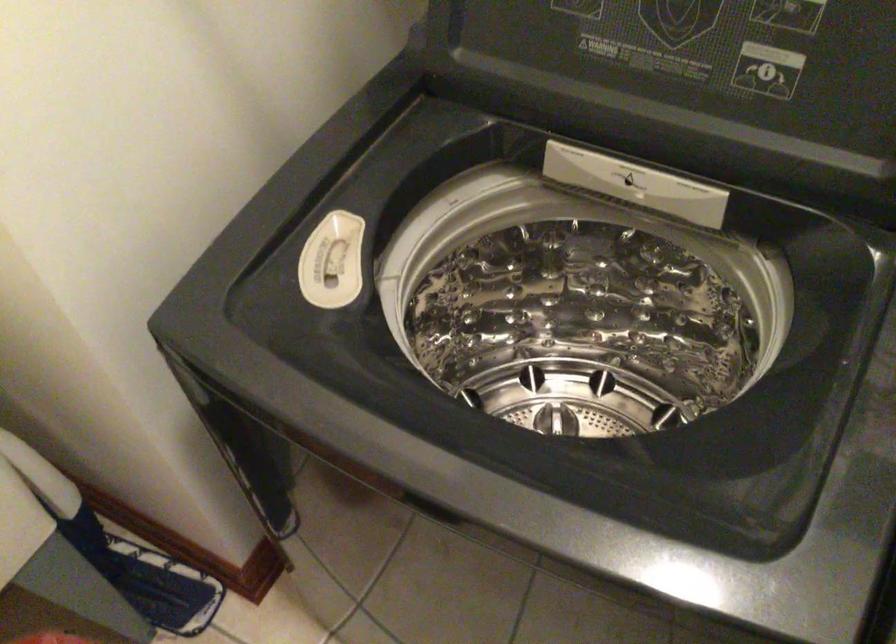
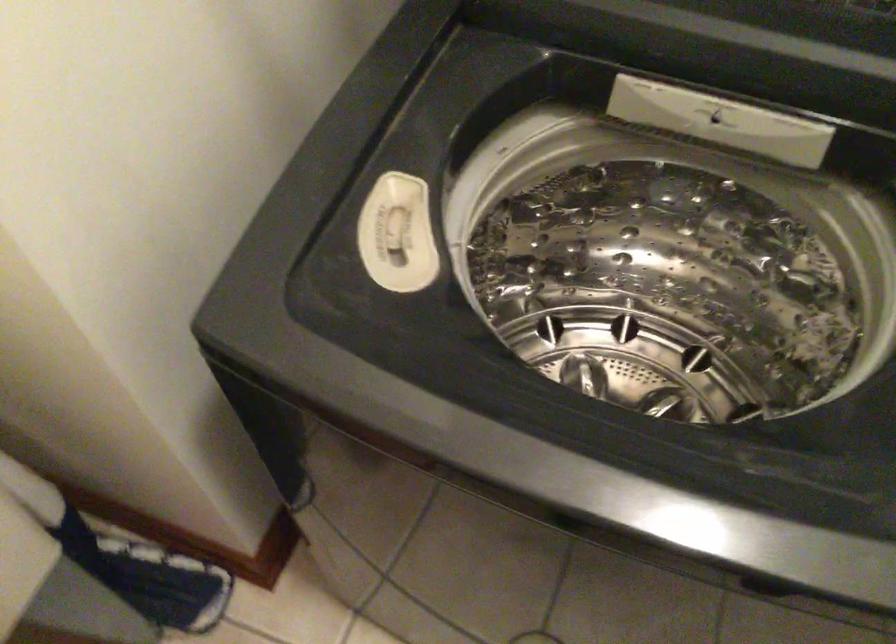
Locate, in the second image, the point that corresponds to the point at 635,183 in the first image.

(719, 120)